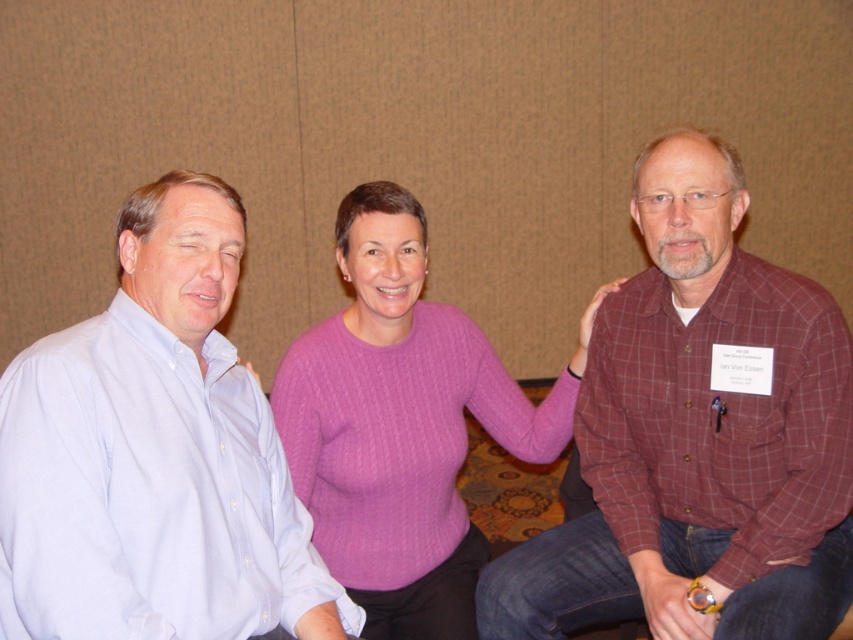
Between light blue shirt at left and purple cable-knit sweater at center, which one has less height?

Standing shorter between the two is light blue shirt at left.

Is light blue shirt at left thinner than purple cable-knit sweater at center?

Yes, light blue shirt at left is thinner than purple cable-knit sweater at center.

Is point (148, 285) positioned before point (424, 406)?

Yes.

Locate an element on the screen. The height and width of the screenshot is (640, 853). light blue shirt at left is located at coordinates (154, 456).

Who is positioned more to the right, plaid shirt at center or light blue shirt at left?

From the viewer's perspective, plaid shirt at center appears more on the right side.

Which of these two, plaid shirt at center or light blue shirt at left, stands shorter?

With less height is light blue shirt at left.

You are a GUI agent. You are given a task and a screenshot of the screen. Output one action in this format:
    pyautogui.click(x=<x>, y=<y>)
    Task: Click on the plaid shirt at center
    
    Given the screenshot: What is the action you would take?
    pyautogui.click(x=698, y=438)

Locate an element on the screen. This screenshot has height=640, width=853. plaid shirt at center is located at coordinates (698, 438).

Can you confirm if plaid shirt at center is wider than purple cable-knit sweater at center?

In fact, plaid shirt at center might be narrower than purple cable-knit sweater at center.

Between point (699, 348) and point (366, 253), which one is positioned behind?

Positioned behind is point (366, 253).

Does point (511, 598) come closer to viewer compared to point (479, 412)?

That is True.

Find the location of a particular element. This screenshot has height=640, width=853. plaid shirt at center is located at coordinates (698, 438).